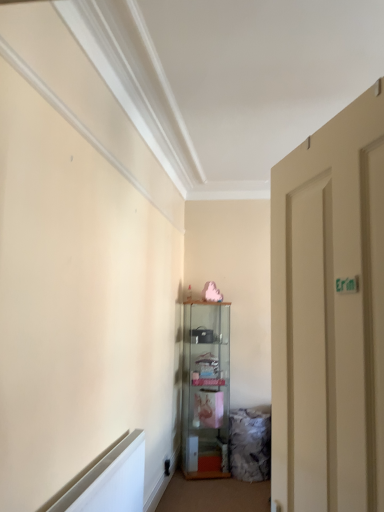
Question: Considering the positions of clear glass cabinet at center and beige matte door at right in the image, is clear glass cabinet at center bigger or smaller than beige matte door at right?

Choices:
 (A) small
 (B) big

Answer: (B)

Question: Considering the positions of point (198, 471) and point (304, 471), is point (198, 471) closer or farther from the camera than point (304, 471)?

Choices:
 (A) farther
 (B) closer

Answer: (A)

Question: From the image's perspective, is clear glass cabinet at center above or below beige matte door at right?

Choices:
 (A) below
 (B) above

Answer: (A)

Question: Is beige matte door at right situated inside clear glass cabinet at center or outside?

Choices:
 (A) inside
 (B) outside

Answer: (B)

Question: In terms of width, does beige matte door at right look wider or thinner when compared to clear glass cabinet at center?

Choices:
 (A) thin
 (B) wide

Answer: (A)

Question: Is beige matte door at right in front of or behind clear glass cabinet at center in the image?

Choices:
 (A) front
 (B) behind

Answer: (A)

Question: Considering the positions of beige matte door at right and clear glass cabinet at center in the image, is beige matte door at right bigger or smaller than clear glass cabinet at center?

Choices:
 (A) small
 (B) big

Answer: (A)